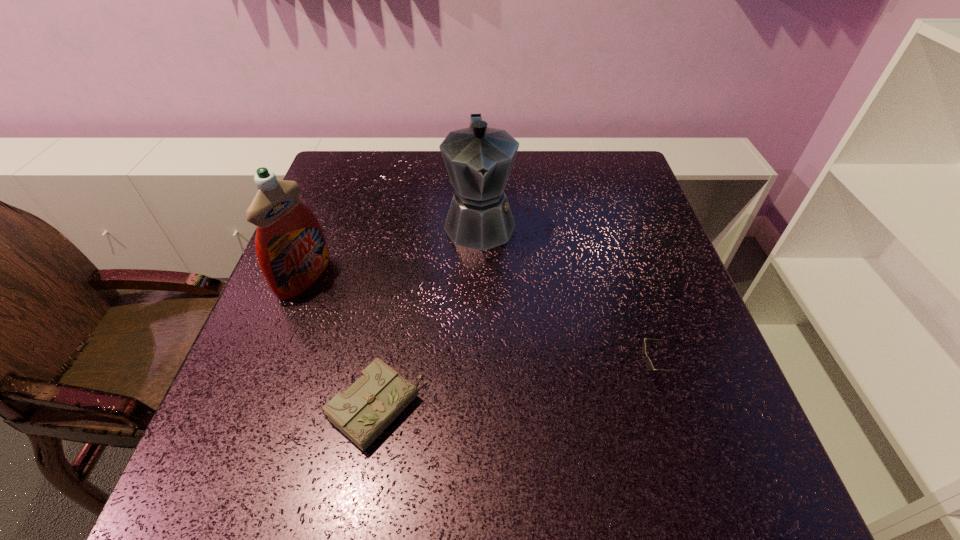
The image size is (960, 540). What are the coordinates of `the shortest object` in the screenshot? It's located at (376, 399).

This screenshot has width=960, height=540. I want to click on the third object from right to left, so (x=376, y=399).

The image size is (960, 540). What are the coordinates of `the third tallest object` in the screenshot? It's located at (649, 365).

Locate an element on the screen. sunglasses is located at coordinates (649, 365).

Where is `detergent`? detergent is located at coordinates (292, 252).

At what (x,y) coordinates should I click in order to perform the action: click on the second object from right to left. Please return your answer as a coordinate pair (x, y). This screenshot has height=540, width=960. Looking at the image, I should click on (478, 159).

At what (x,y) coordinates should I click in order to perform the action: click on free space located on the right of the shortest object. Please return your answer as a coordinate pair (x, y). Looking at the image, I should click on (482, 408).

Find the location of a particular element. vacant space located 0.350m in front of the lenses of the sunglasses is located at coordinates (448, 372).

In order to click on free location located in front of the lenses of the sunglasses in this screenshot , I will do `click(523, 372)`.

Where is `vacant space located in front of the lenses of the sunglasses`? vacant space located in front of the lenses of the sunglasses is located at coordinates (486, 372).